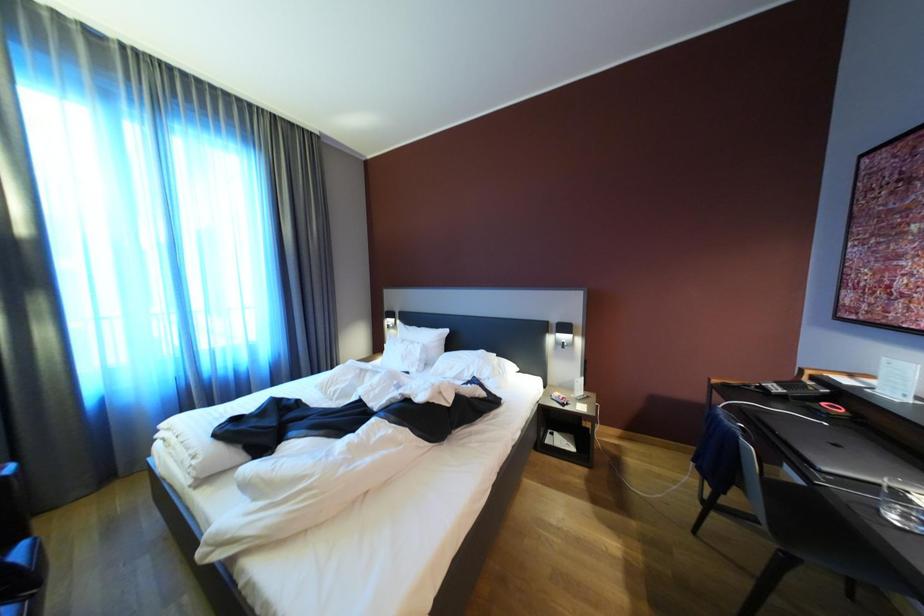
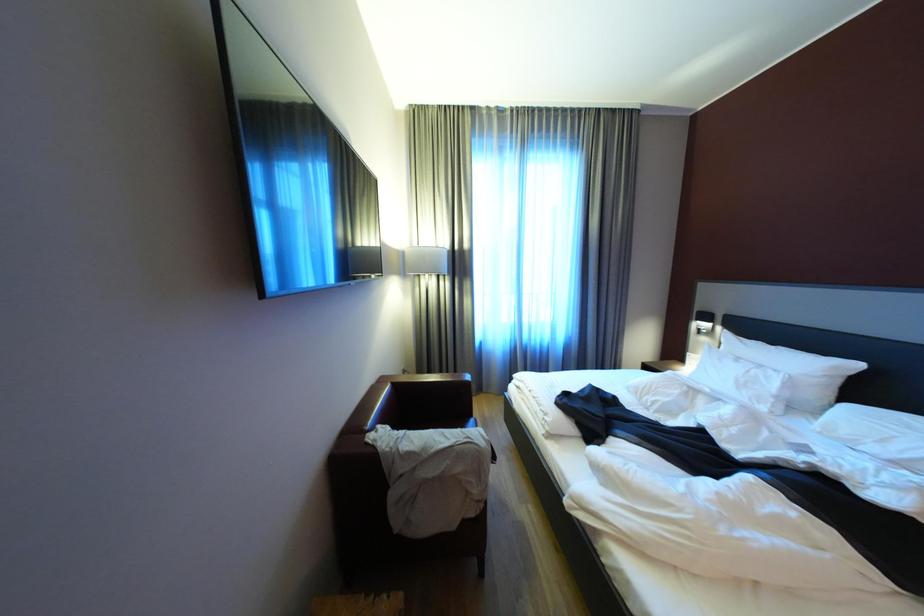
Question: Based on the continuous images, in which direction is the camera rotating? Reply with the corresponding letter.

Choices:
 (A) Left
 (B) Right
 (C) Up
 (D) Down

Answer: (A)